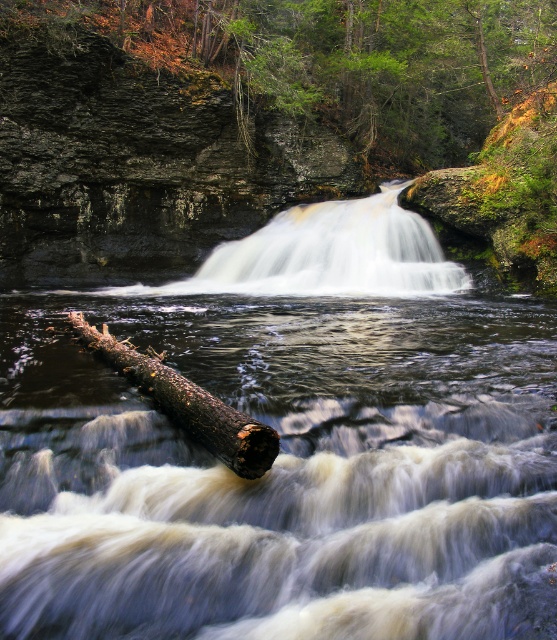
Question: Can you confirm if white frothy water at center is smaller than dark brown rough log at lower center?

Choices:
 (A) yes
 (B) no

Answer: (B)

Question: Is green mossy rock at upper center positioned at the back of white frothy water at center?

Choices:
 (A) no
 (B) yes

Answer: (B)

Question: Is white frothy water at center to the right of dark brown rough log at lower center from the viewer's perspective?

Choices:
 (A) yes
 (B) no

Answer: (A)

Question: Considering the real-world distances, which object is closest to the green mossy rock at upper center?

Choices:
 (A) dark brown rough log at lower center
 (B) white frothy water at center

Answer: (B)

Question: Which point is farther to the camera?

Choices:
 (A) dark brown rough log at lower center
 (B) green mossy rock at upper center
 (C) white frothy water at center

Answer: (B)

Question: Which point is closer to the camera taking this photo?

Choices:
 (A) (99, 346)
 (B) (456, 116)
 (C) (451, 291)

Answer: (A)